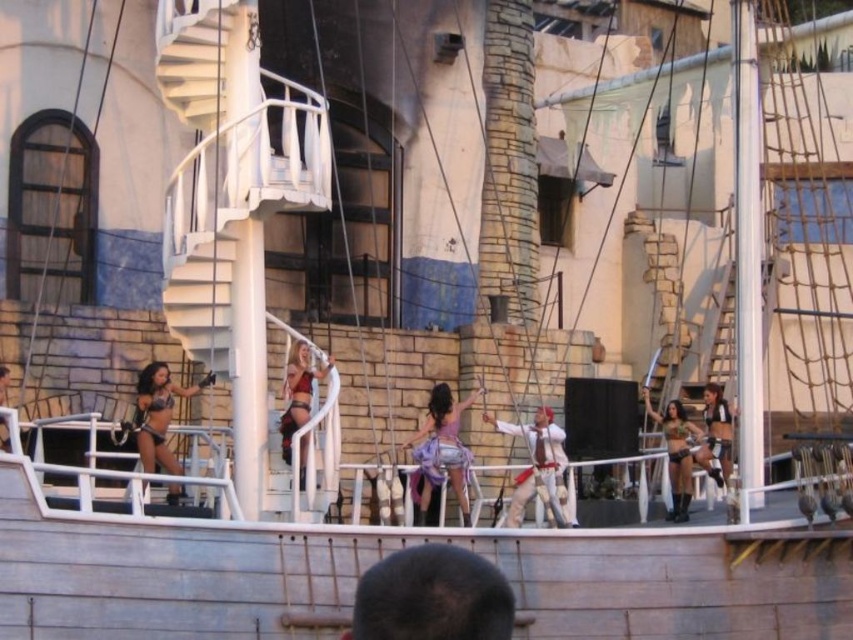
You are a photographer standing at the camera position. You want to take a photo of the dark brown fur hat at lower center. Can you fit the entire hat into your camera frame if the camera has a 50mm lens? Assume the camera sensor is 24x36mm and the hat is 20cm tall.

The dark brown fur hat at lower center is 35.10 meters away from the camera. Using the lens formula, the required sensor height would be approximately 0.014 meters, which is smaller than the camera sensor height of 0.024 meters. Therefore, the entire hat can fit into the frame.